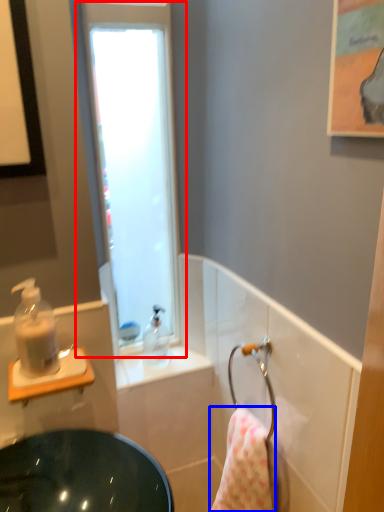
Question: Which object appears farthest to the camera in this image, window (highlighted by a red box) or bath towel (highlighted by a blue box)?

Choices:
 (A) window
 (B) bath towel

Answer: (A)